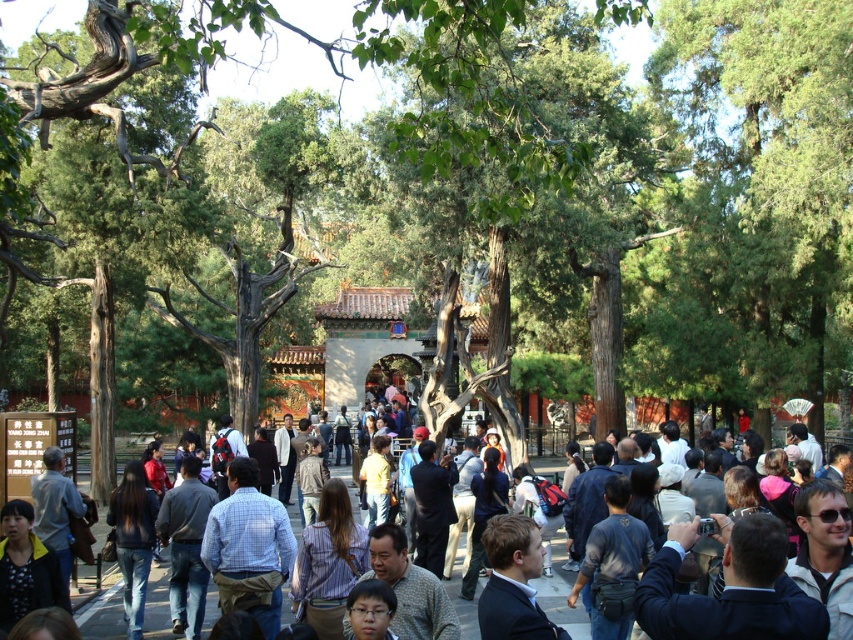
Question: Estimate the real-world distances between objects in this image. Which object is farther from the striped shirt at center?

Choices:
 (A) multicolored casual clothing at center
 (B) dark gray fabric backpack at center
 (C) dark blue jeans at lower left
 (D) dark blue shirt at center

Answer: (B)

Question: Does dark gray fabric backpack at center lie behind dark blue jeans at lower left?

Choices:
 (A) no
 (B) yes

Answer: (A)

Question: Considering the relative positions of multicolored casual clothing at center and striped shirt at lower left in the image provided, where is multicolored casual clothing at center located with respect to striped shirt at lower left?

Choices:
 (A) left
 (B) right

Answer: (B)

Question: Is striped shirt at center positioned at the back of dark gray fabric backpack at center?

Choices:
 (A) yes
 (B) no

Answer: (B)

Question: Which point is closer to the camera taking this photo?

Choices:
 (A) (126, 634)
 (B) (90, 618)

Answer: (A)

Question: Among these points, which one is farthest from the camera?

Choices:
 (A) (456, 604)
 (B) (634, 532)
 (C) (136, 476)

Answer: (A)